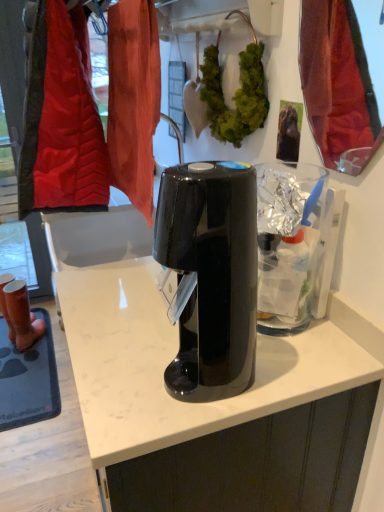
Question: Is green leafy plant at center to the right of black glossy coffee maker at center from the viewer's perspective?

Choices:
 (A) yes
 (B) no

Answer: (A)

Question: From the image's perspective, does green leafy plant at center appear higher than black glossy coffee maker at center?

Choices:
 (A) no
 (B) yes

Answer: (B)

Question: Is the position of green leafy plant at center more distant than that of black glossy coffee maker at center?

Choices:
 (A) yes
 (B) no

Answer: (A)

Question: Is green leafy plant at center taller than black glossy coffee maker at center?

Choices:
 (A) yes
 (B) no

Answer: (B)

Question: Is green leafy plant at center touching black glossy coffee maker at center?

Choices:
 (A) no
 (B) yes

Answer: (A)

Question: Based on their sizes in the image, would you say shiny red fabric at upper right is bigger or smaller than matte brown boots at left?

Choices:
 (A) small
 (B) big

Answer: (A)

Question: Do you think shiny red fabric at upper right is within matte brown boots at left, or outside of it?

Choices:
 (A) inside
 (B) outside

Answer: (B)

Question: Relative to matte brown boots at left, is shiny red fabric at upper right in front or behind?

Choices:
 (A) front
 (B) behind

Answer: (A)

Question: Is shiny red fabric at upper right to the left or to the right of matte brown boots at left in the image?

Choices:
 (A) left
 (B) right

Answer: (B)

Question: In terms of height, does black glossy coffee maker at center look taller or shorter compared to green leafy plant at center?

Choices:
 (A) short
 (B) tall

Answer: (B)

Question: Would you say black glossy coffee maker at center is to the left or to the right of green leafy plant at center in the picture?

Choices:
 (A) right
 (B) left

Answer: (B)

Question: Considering the positions of black glossy coffee maker at center and green leafy plant at center in the image, is black glossy coffee maker at center bigger or smaller than green leafy plant at center?

Choices:
 (A) big
 (B) small

Answer: (A)

Question: From a real-world perspective, is black glossy coffee maker at center positioned above or below green leafy plant at center?

Choices:
 (A) below
 (B) above

Answer: (A)

Question: Considering the positions of point (28, 320) and point (241, 53), is point (28, 320) closer or farther from the camera than point (241, 53)?

Choices:
 (A) closer
 (B) farther

Answer: (B)

Question: Based on their positions, is matte brown boots at left located to the left or right of green leafy plant at center?

Choices:
 (A) left
 (B) right

Answer: (A)